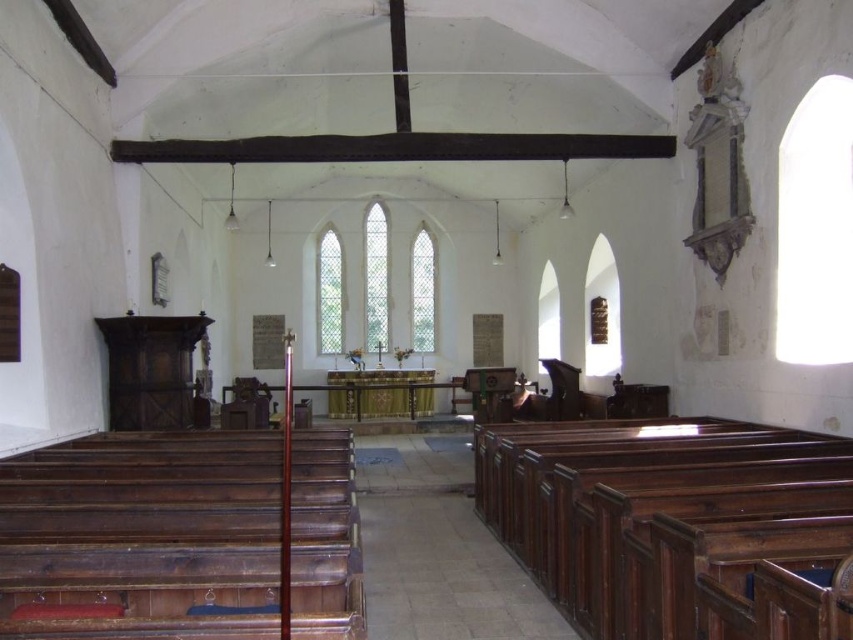
You are standing at the entrance of the church and want to take a photo of the point at coordinates (316, 586). If your camera can focus on objects within 4 meters, will it be able to capture the point clearly?

The point at coordinates (316, 586) is 4.43 meters away from the camera, which is beyond the 4 meter focus range. The camera will not be able to capture the point clearly.

You are standing at the entrance of the church and see two points marked on the floor. The first point is at the coordinates point [740,470] and the second point is at point [39,605]. Which point is closer to the altar?

Point [740,470] is behind point [39,605], so it is closer to the altar.

You are standing at the entrance of the church and want to move towards the altar. There is a dark brown polished wood church bench at lower right and a dark wood beam at center in your path. Which object will you encounter first?

The dark brown polished wood church bench at lower right is in front of the dark wood beam at center, so you will encounter the dark brown polished wood church bench at lower right first.